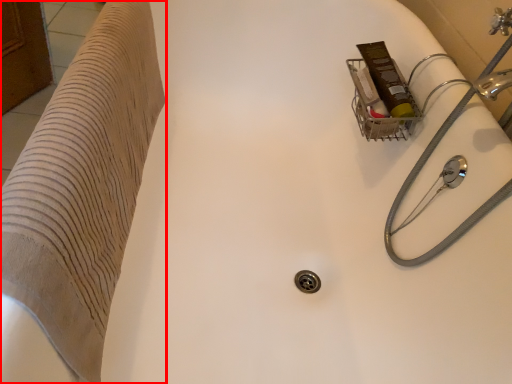
Question: From the image's perspective, considering the relative positions of furniture (annotated by the red box) and water pipe in the image provided, where is furniture (annotated by the red box) located with respect to the staircase?

Choices:
 (A) above
 (B) below

Answer: (A)